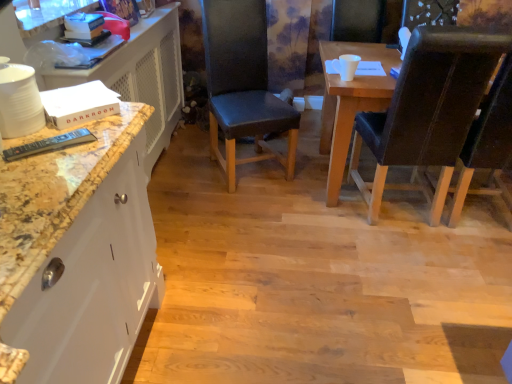
Image resolution: width=512 pixels, height=384 pixels. In order to click on free space to the left of black leather chair at right, the 2th chair viewed from the left in this screenshot , I will do `click(311, 216)`.